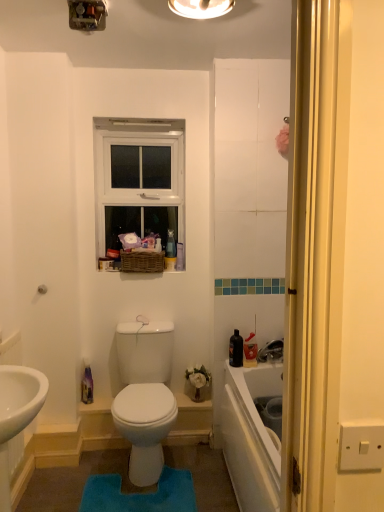
This screenshot has height=512, width=384. Describe the element at coordinates (87, 15) in the screenshot. I see `metallic switchplate at upper center, which is the 2th light fixture in right-to-left order` at that location.

At what (x,y) coordinates should I click in order to perform the action: click on matte white light fixture at upper center, arranged as the first light fixture when viewed from the right. Please return your answer as a coordinate pair (x, y). This screenshot has width=384, height=512. Looking at the image, I should click on (201, 8).

The image size is (384, 512). I want to click on blue plush bath mat at center, so click(140, 494).

The height and width of the screenshot is (512, 384). What are the coordinates of `white plastic window at upper center` in the screenshot? It's located at (140, 191).

Locate an element on the screen. The width and height of the screenshot is (384, 512). light fixture behind the matte white light fixture at upper center, arranged as the second light fixture when viewed from the left is located at coordinates (87, 15).

Consider the image. Which of these two, metallic switchplate at upper center, which is the 2th light fixture in right-to-left order, or matte white light fixture at upper center, arranged as the first light fixture when viewed from the right, is smaller?

metallic switchplate at upper center, which is the 2th light fixture in right-to-left order, is smaller.

Can you see metallic switchplate at upper center, which is the 2th light fixture in right-to-left order, touching matte white light fixture at upper center, arranged as the first light fixture when viewed from the right?

They are not placed beside each other.

Are white plastic window at upper center and metallic switchplate at upper center, which appears as the first light fixture when viewed from the left, making contact?

There is a gap between white plastic window at upper center and metallic switchplate at upper center, which appears as the first light fixture when viewed from the left.

Who is shorter, white plastic window at upper center or metallic switchplate at upper center, which is the 2th light fixture in right-to-left order?

metallic switchplate at upper center, which is the 2th light fixture in right-to-left order.

Can you tell me how much white plastic window at upper center and metallic switchplate at upper center, which appears as the first light fixture when viewed from the left, differ in facing direction?

white plastic window at upper center and metallic switchplate at upper center, which appears as the first light fixture when viewed from the left, are facing 0.466 degrees away from each other.

Is point (147, 128) closer to camera compared to point (102, 17)?

No, it is behind (102, 17).

From a real-world perspective, who is located higher, white plastic window at upper center or blue plush bath mat at center?

white plastic window at upper center is physically above.

Can blue plush bath mat at center be found inside white plastic window at upper center?

No, blue plush bath mat at center is not inside white plastic window at upper center.

Would you say white plastic window at upper center is a long distance from blue plush bath mat at center?

Indeed, white plastic window at upper center is not near blue plush bath mat at center.

Based on their sizes in the image, would you say blue plush bath mat at center is bigger or smaller than white plastic window at upper center?

blue plush bath mat at center is smaller than white plastic window at upper center.

Considering their positions, is blue plush bath mat at center located in front of or behind white plastic window at upper center?

Clearly, blue plush bath mat at center is in front of white plastic window at upper center.

Visually, is blue plush bath mat at center positioned to the left or to the right of white plastic window at upper center?

blue plush bath mat at center is to the right of white plastic window at upper center.

Can you confirm if metallic switchplate at upper center, which is the 2th light fixture in right-to-left order, is bigger than blue plush bath mat at center?

Incorrect, metallic switchplate at upper center, which is the 2th light fixture in right-to-left order, is not larger than blue plush bath mat at center.

Which is behind, metallic switchplate at upper center, which is the 2th light fixture in right-to-left order, or blue plush bath mat at center?

blue plush bath mat at center is further away from the camera.

From the image's perspective, is metallic switchplate at upper center, which appears as the first light fixture when viewed from the left, under blue plush bath mat at center?

No.

Is metallic switchplate at upper center, which appears as the first light fixture when viewed from the left, inside or outside of blue plush bath mat at center?

metallic switchplate at upper center, which appears as the first light fixture when viewed from the left, is spatially situated outside blue plush bath mat at center.

Considering the sizes of objects white plastic window at upper center and matte white light fixture at upper center, arranged as the second light fixture when viewed from the left, in the image provided, who is bigger, white plastic window at upper center or matte white light fixture at upper center, arranged as the second light fixture when viewed from the left,?

With larger size is white plastic window at upper center.

Can you confirm if white plastic window at upper center is wider than matte white light fixture at upper center, arranged as the second light fixture when viewed from the left?

In fact, white plastic window at upper center might be narrower than matte white light fixture at upper center, arranged as the second light fixture when viewed from the left.

Is white plastic window at upper center far away from matte white light fixture at upper center, arranged as the first light fixture when viewed from the right?

Yes.

Which is behind, white plastic window at upper center or matte white light fixture at upper center, arranged as the second light fixture when viewed from the left?

white plastic window at upper center is more distant.

What's the angular difference between blue plush bath mat at center and matte white light fixture at upper center, arranged as the first light fixture when viewed from the right,'s facing directions?

The facing directions of blue plush bath mat at center and matte white light fixture at upper center, arranged as the first light fixture when viewed from the right, are 1.57 degrees apart.

Does blue plush bath mat at center have a larger size compared to matte white light fixture at upper center, arranged as the first light fixture when viewed from the right?

Correct, blue plush bath mat at center is larger in size than matte white light fixture at upper center, arranged as the first light fixture when viewed from the right.

From their relative heights in the image, would you say blue plush bath mat at center is taller or shorter than matte white light fixture at upper center, arranged as the second light fixture when viewed from the left?

Clearly, blue plush bath mat at center is shorter compared to matte white light fixture at upper center, arranged as the second light fixture when viewed from the left.

Is blue plush bath mat at center facing away from matte white light fixture at upper center, arranged as the second light fixture when viewed from the left?

blue plush bath mat at center is not turned away from matte white light fixture at upper center, arranged as the second light fixture when viewed from the left.

Find the location of a particular element. This screenshot has width=384, height=512. light fixture behind the matte white light fixture at upper center, arranged as the second light fixture when viewed from the left is located at coordinates (87, 15).

What are the coordinates of `light fixture that is the 1st object located in front of the white plastic window at upper center` in the screenshot? It's located at (87, 15).

In the scene shown: Based on their spatial positions, is metallic switchplate at upper center, which is the 2th light fixture in right-to-left order, or white plastic window at upper center further from matte white light fixture at upper center, arranged as the second light fixture when viewed from the left?

white plastic window at upper center.

Based on their spatial positions, is blue plush bath mat at center or metallic switchplate at upper center, which appears as the first light fixture when viewed from the left, closer to matte white light fixture at upper center, arranged as the second light fixture when viewed from the left?

The object closer to matte white light fixture at upper center, arranged as the second light fixture when viewed from the left, is metallic switchplate at upper center, which appears as the first light fixture when viewed from the left.

Which object lies further to the anchor point metallic switchplate at upper center, which is the 2th light fixture in right-to-left order, matte white light fixture at upper center, arranged as the second light fixture when viewed from the left, or white plastic window at upper center?

white plastic window at upper center is positioned further to the anchor metallic switchplate at upper center, which is the 2th light fixture in right-to-left order.

Which object lies nearer to the anchor point blue plush bath mat at center, metallic switchplate at upper center, which appears as the first light fixture when viewed from the left, or white plastic window at upper center?

white plastic window at upper center lies closer to blue plush bath mat at center than the other object.

Considering their positions, is blue plush bath mat at center positioned further to matte white light fixture at upper center, arranged as the second light fixture when viewed from the left, than white plastic window at upper center?

Based on the image, blue plush bath mat at center appears to be further to matte white light fixture at upper center, arranged as the second light fixture when viewed from the left.

From the image, which object appears to be nearer to metallic switchplate at upper center, which appears as the first light fixture when viewed from the left, blue plush bath mat at center or white plastic window at upper center?

white plastic window at upper center is positioned closer to the anchor metallic switchplate at upper center, which appears as the first light fixture when viewed from the left.

When comparing their distances from white plastic window at upper center, does blue plush bath mat at center or matte white light fixture at upper center, arranged as the second light fixture when viewed from the left, seem closer?

The object closer to white plastic window at upper center is matte white light fixture at upper center, arranged as the second light fixture when viewed from the left.

Based on their spatial positions, is white plastic window at upper center or blue plush bath mat at center closer to matte white light fixture at upper center, arranged as the first light fixture when viewed from the right?

The object closer to matte white light fixture at upper center, arranged as the first light fixture when viewed from the right, is white plastic window at upper center.

The image size is (384, 512). In order to click on light fixture between matte white light fixture at upper center, arranged as the first light fixture when viewed from the right, and blue plush bath mat at center in the up-down direction in this screenshot , I will do `click(87, 15)`.

You are a GUI agent. You are given a task and a screenshot of the screen. Output one action in this format:
    pyautogui.click(x=<x>, y=<y>)
    Task: Click on the light fixture between matte white light fixture at upper center, arranged as the second light fixture when viewed from the left, and white plastic window at upper center from front to back
    The height and width of the screenshot is (512, 384).
    Given the screenshot: What is the action you would take?
    pyautogui.click(x=87, y=15)

I want to click on window between metallic switchplate at upper center, which is the 2th light fixture in right-to-left order, and blue plush bath mat at center vertically, so click(x=140, y=191).

Identify the location of window between matte white light fixture at upper center, arranged as the first light fixture when viewed from the right, and blue plush bath mat at center, in the vertical direction. The height and width of the screenshot is (512, 384). (140, 191).